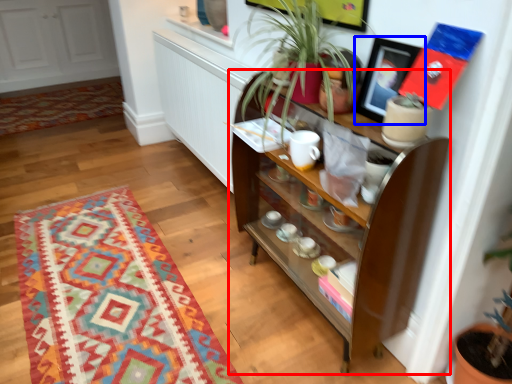
Question: Among these objects, which one is nearest to the camera, shelf (highlighted by a red box) or picture frame (highlighted by a blue box)?

Choices:
 (A) shelf
 (B) picture frame

Answer: (A)